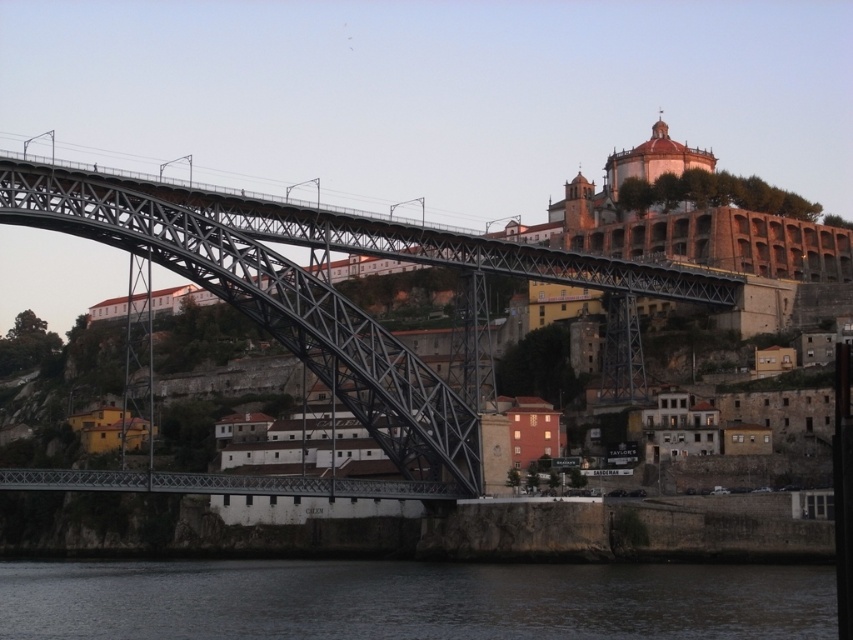
Image resolution: width=853 pixels, height=640 pixels. Describe the element at coordinates (410, 600) in the screenshot. I see `dark water at lower center` at that location.

Who is shorter, dark water at lower center or metallic steel bridge at left?

dark water at lower center

This screenshot has height=640, width=853. Identify the location of dark water at lower center. (410, 600).